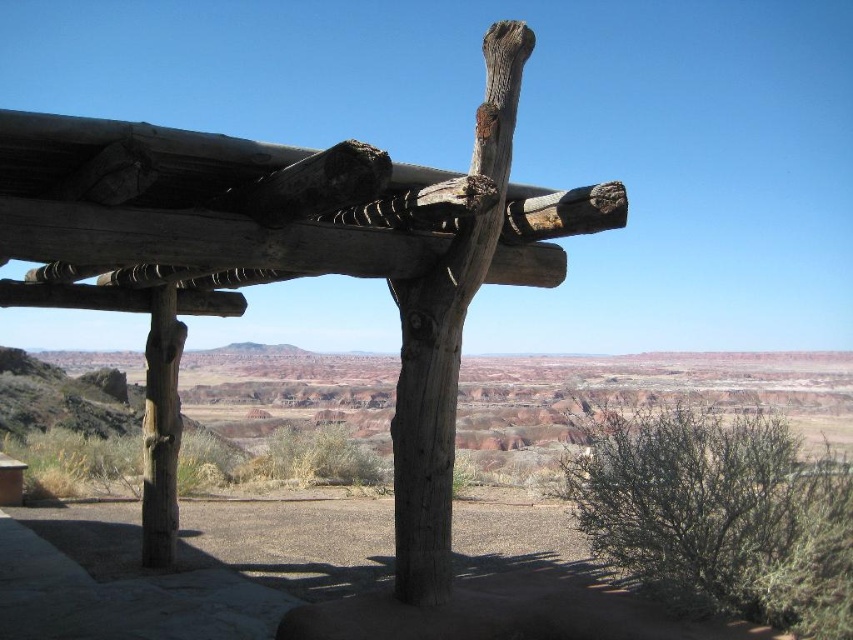
You are standing in front of the rustic wooden structure in the desert. You see a natural wood post at center and a natural wood pole at center. Which one is positioned to the left?

The natural wood post at center is positioned to the left of the natural wood pole at center.